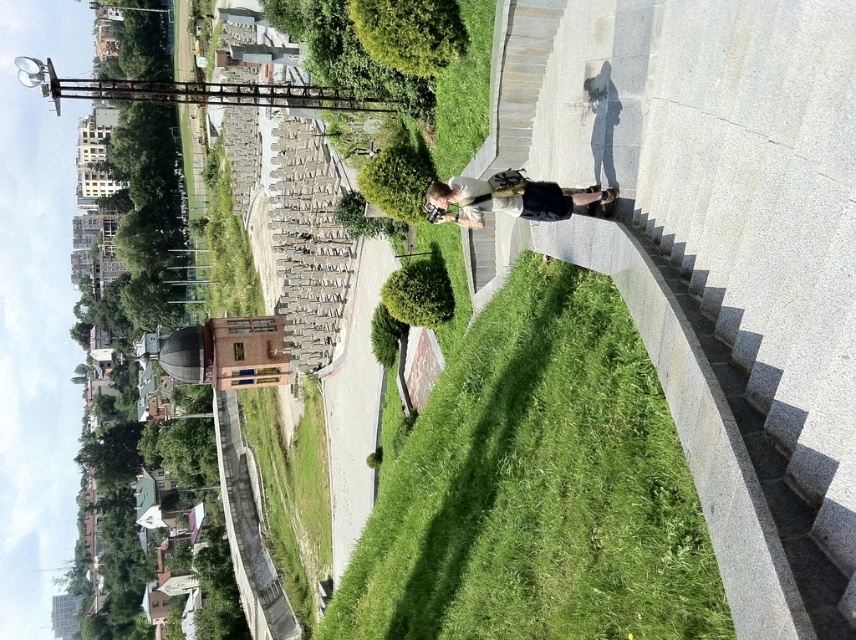
You are standing at the bottom of the curved staircase and see both the green grassy at center and the light beige fabric jacket at center. Which object is located to the left when facing upwards towards the top of the stairs?

The green grassy at center is positioned on the left side of light beige fabric jacket at center, so when facing upwards towards the top of the stairs, the green grassy at center will be to the left of the light beige fabric jacket at center.